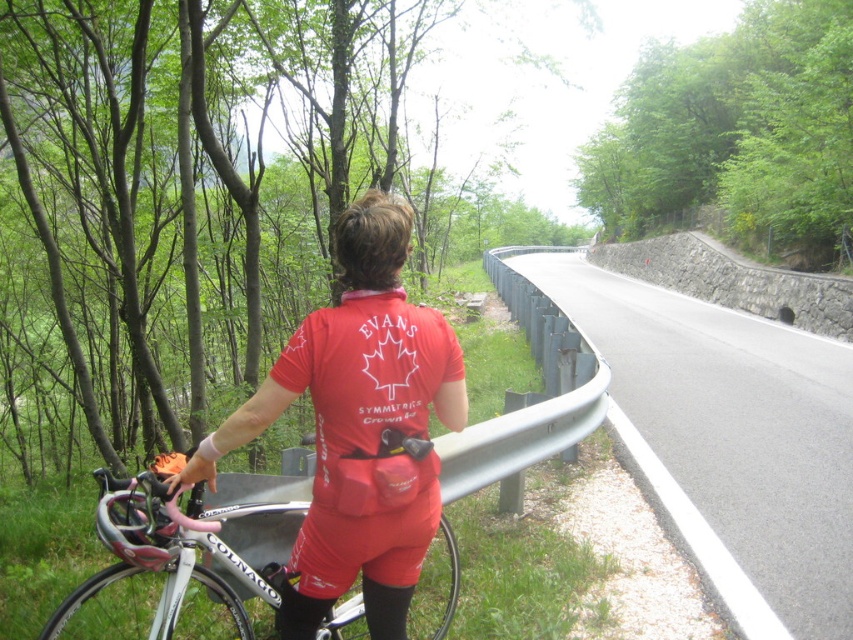
Is red matte cycling jersey at center positioned at the back of white glossy bicycle at center?

No, red matte cycling jersey at center is closer to the viewer.

I want to click on red matte cycling jersey at center, so click(358, 428).

Identify the location of red matte cycling jersey at center. The height and width of the screenshot is (640, 853). (358, 428).

Find the location of a particular element. The image size is (853, 640). red matte cycling jersey at center is located at coordinates (358, 428).

Is asphalt road at center further to the viewer compared to red matte cycling jersey at center?

Yes, it is.

Can you confirm if asphalt road at center is positioned below red matte cycling jersey at center?

Actually, asphalt road at center is above red matte cycling jersey at center.

Between point (705, 332) and point (364, 284), which one is positioned behind?

Point (705, 332)

At what (x,y) coordinates should I click in order to perform the action: click on asphalt road at center. Please return your answer as a coordinate pair (x, y). The image size is (853, 640). Looking at the image, I should click on (730, 433).

Is asphalt road at center further to camera compared to white glossy bicycle at center?

Yes, it is.

Which is above, asphalt road at center or white glossy bicycle at center?

Positioned higher is asphalt road at center.

Between point (815, 397) and point (231, 589), which one is positioned in front?

Positioned in front is point (231, 589).

Where is `asphalt road at center`? This screenshot has height=640, width=853. asphalt road at center is located at coordinates (730, 433).